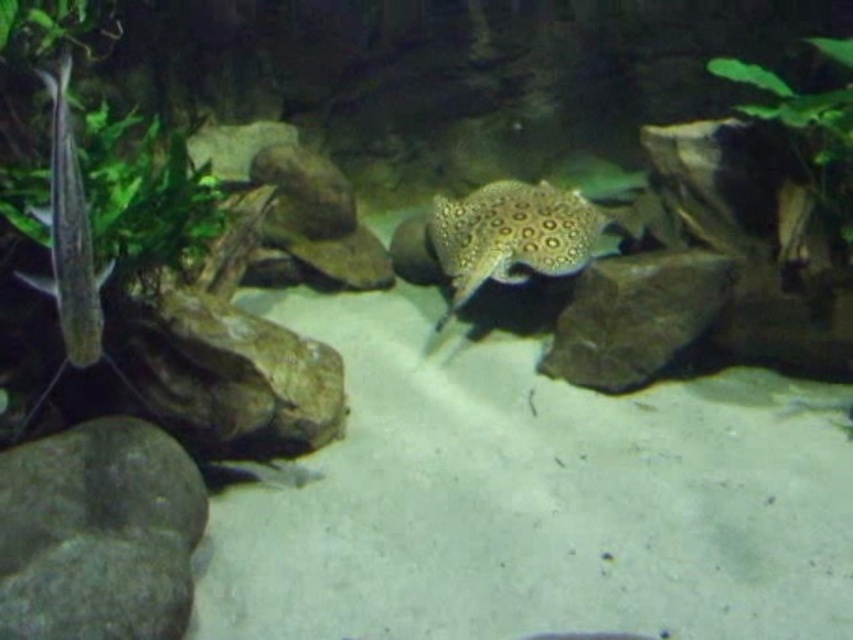
Where is `gray matte rock at lower left`? This screenshot has width=853, height=640. gray matte rock at lower left is located at coordinates (97, 532).

Does gray matte rock at lower left have a smaller size compared to shiny golden stingray at center?

Correct, gray matte rock at lower left occupies less space than shiny golden stingray at center.

Does point (3, 490) come in front of point (512, 209)?

Yes, point (3, 490) is closer to viewer.

Where is `gray matte rock at lower left`? gray matte rock at lower left is located at coordinates (97, 532).

Does smooth gray rock at center appear on the left side of translucent white fish at left?

In fact, smooth gray rock at center is to the right of translucent white fish at left.

Does smooth gray rock at center have a greater height compared to translucent white fish at left?

No.

Does point (660, 320) come behind point (59, 205)?

That is True.

Find the location of a particular element. smooth gray rock at center is located at coordinates (635, 316).

Between smooth gray rock at left and smooth gray rock at center, which one appears on the left side from the viewer's perspective?

smooth gray rock at left is more to the left.

Is smooth gray rock at left below smooth gray rock at center?

Yes, smooth gray rock at left is below smooth gray rock at center.

Between point (160, 342) and point (685, 275), which one is positioned behind?

The point (685, 275) is behind.

Find the location of a particular element. Image resolution: width=853 pixels, height=640 pixels. smooth gray rock at left is located at coordinates (231, 376).